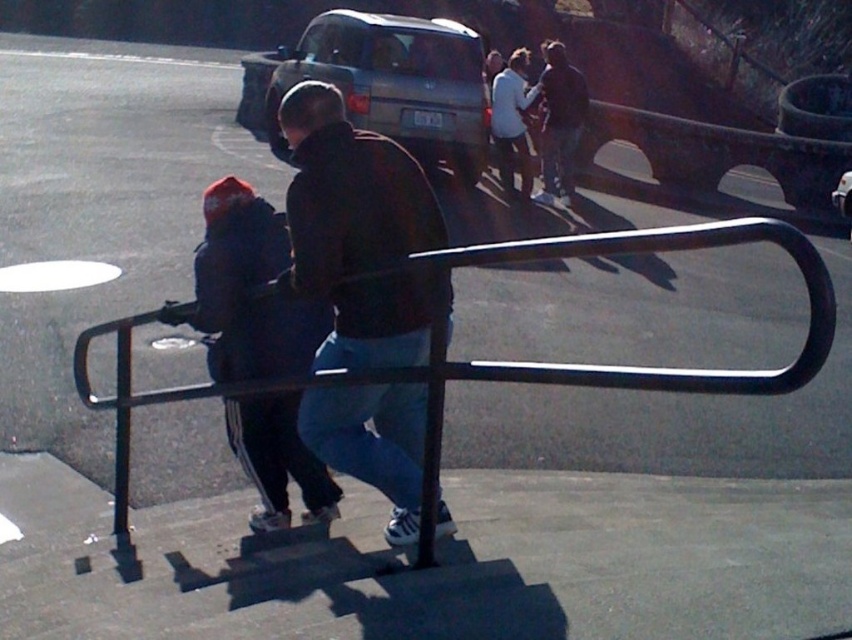
Question: Does dark brown leather jacket at center have a lesser width compared to dark blue jeans at center?

Choices:
 (A) no
 (B) yes

Answer: (B)

Question: Estimate the real-world distances between objects in this image. Which object is closer to the silver metallic suv at center?

Choices:
 (A) dark blue fabric jacket at left
 (B) dark brown leather jacket at center
 (C) dark blue jeans at center

Answer: (C)

Question: Which object is the farthest from the dark blue jeans at center?

Choices:
 (A) dark blue fabric jacket at left
 (B) silver metallic suv at center
 (C) dark brown leather jacket at center

Answer: (C)

Question: Which object appears farthest from the camera in this image?

Choices:
 (A) dark blue fabric jacket at left
 (B) dark blue jeans at center
 (C) dark brown leather jacket at center
 (D) silver metallic suv at center

Answer: (B)

Question: Does dark brown leather jacket at center appear under dark blue fabric jacket at left?

Choices:
 (A) no
 (B) yes

Answer: (A)

Question: Does dark blue fabric jacket at left appear over dark blue jeans at center?

Choices:
 (A) yes
 (B) no

Answer: (B)